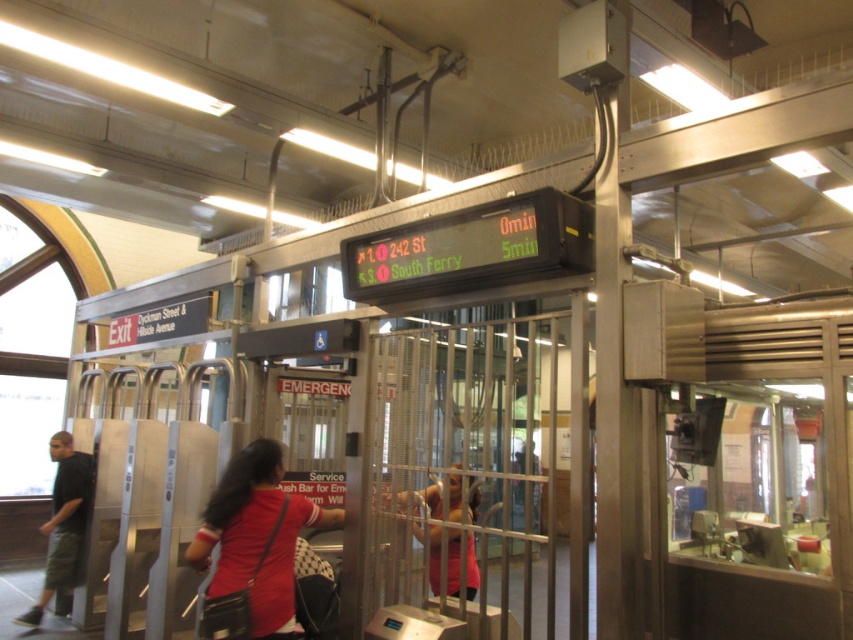
Question: Which object is closer to the camera taking this photo?

Choices:
 (A) red fabric shirt at center
 (B) matte black shirt at left
 (C) pink fabric dress at center

Answer: (A)

Question: Does matte black shirt at left have a larger size compared to pink fabric dress at center?

Choices:
 (A) yes
 (B) no

Answer: (B)

Question: Can you confirm if red fabric shirt at center is positioned below matte black shirt at left?

Choices:
 (A) yes
 (B) no

Answer: (B)

Question: Among these points, which one is farthest from the camera?

Choices:
 (A) (457, 465)
 (B) (274, 486)

Answer: (A)

Question: Is red fabric shirt at center closer to the viewer compared to matte black shirt at left?

Choices:
 (A) yes
 (B) no

Answer: (A)

Question: Among these objects, which one is nearest to the camera?

Choices:
 (A) pink fabric dress at center
 (B) red fabric shirt at center

Answer: (B)